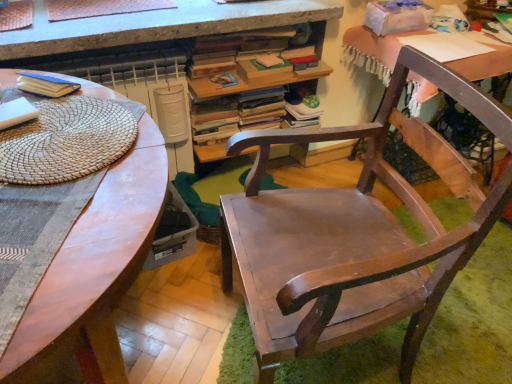
Where is `free point to the right of matte blue paperback book at upper left`? This screenshot has width=512, height=384. free point to the right of matte blue paperback book at upper left is located at coordinates (94, 98).